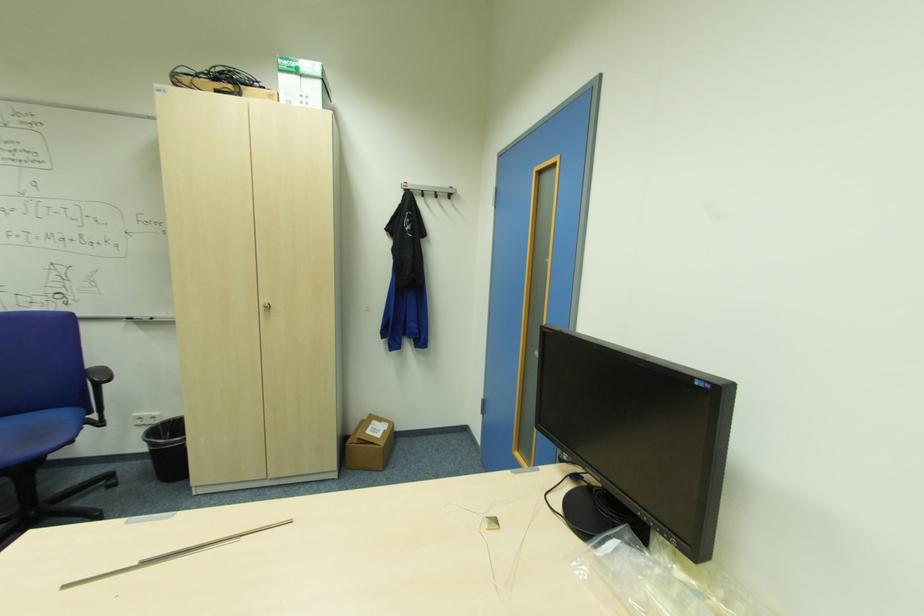
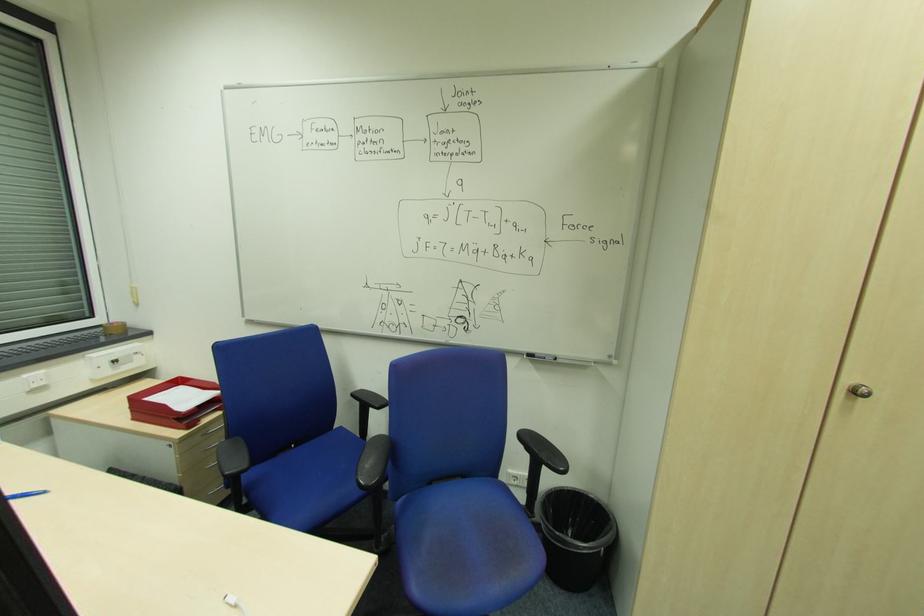
Find the pixel in the second image that matches pixel 271 307 in the first image.

(860, 392)